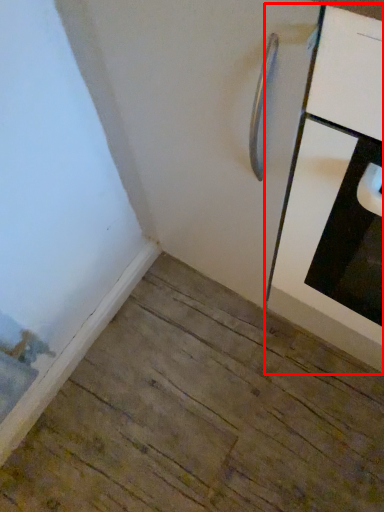
Question: From the image's perspective, where is cabinetry (annotated by the red box) located relative to door?

Choices:
 (A) below
 (B) above

Answer: (A)